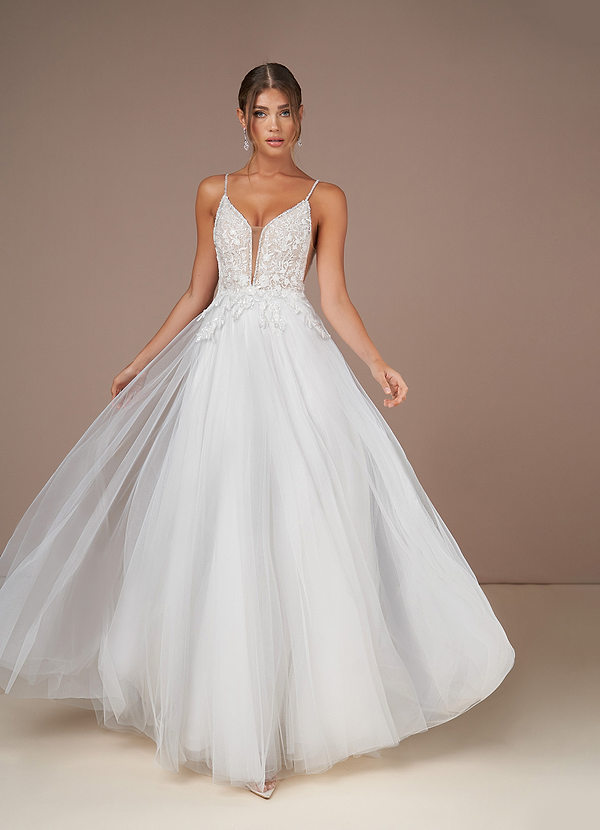
Find the location of a particular element. lace is located at coordinates (409, 540).